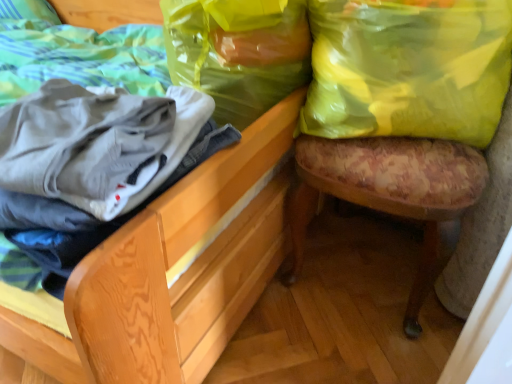
Question: Based on their positions, is floral fabric stool at right located to the left or right of yellow plastic bag at upper right, which ranks as the 1th shopping bag in right-to-left order?

Choices:
 (A) right
 (B) left

Answer: (A)

Question: Considering the positions of floral fabric stool at right and yellow plastic bag at upper right, which is the 2th shopping bag in left-to-right order, in the image, is floral fabric stool at right taller or shorter than yellow plastic bag at upper right, which is the 2th shopping bag in left-to-right order,?

Choices:
 (A) short
 (B) tall

Answer: (B)

Question: Which object is the farthest from the wooden chair at lower right?

Choices:
 (A) floral fabric stool at right
 (B) translucent yellow plastic bag at upper right, which is the second shopping bag in right-to-left order
 (C) yellow plastic bag at upper right, which is the 2th shopping bag in left-to-right order

Answer: (C)

Question: Which object is positioned farthest from the floral fabric stool at right?

Choices:
 (A) yellow plastic bag at upper right, which is the 2th shopping bag in left-to-right order
 (B) translucent yellow plastic bag at upper right, the 1th shopping bag viewed from the left
 (C) wooden chair at lower right

Answer: (B)